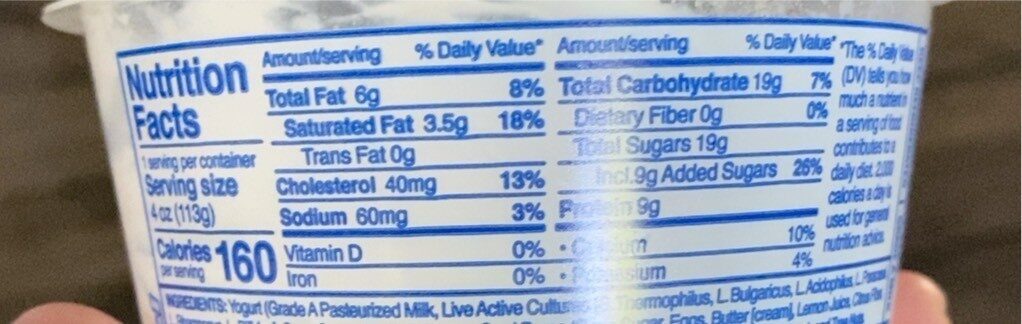
Find the location of a particular element. The image size is (1022, 324). empty space behind tub is located at coordinates (67, 194), (995, 171).